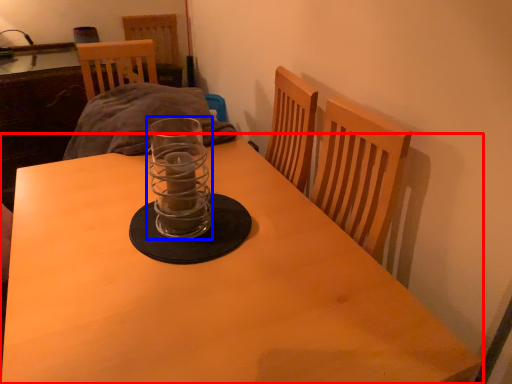
Question: Among these objects, which one is nearest to the camera, table (highlighted by a red box) or candle holder (highlighted by a blue box)?

Choices:
 (A) table
 (B) candle holder

Answer: (A)